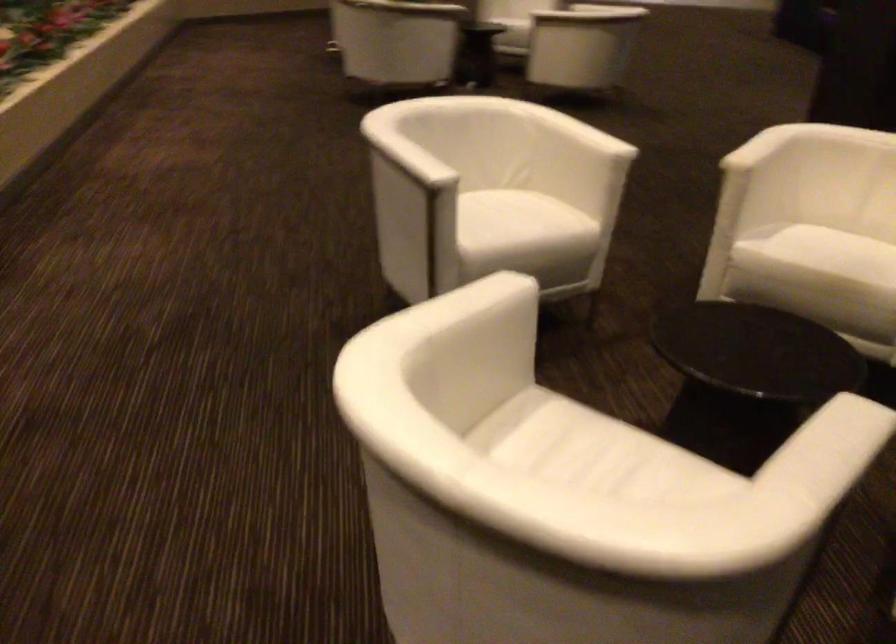
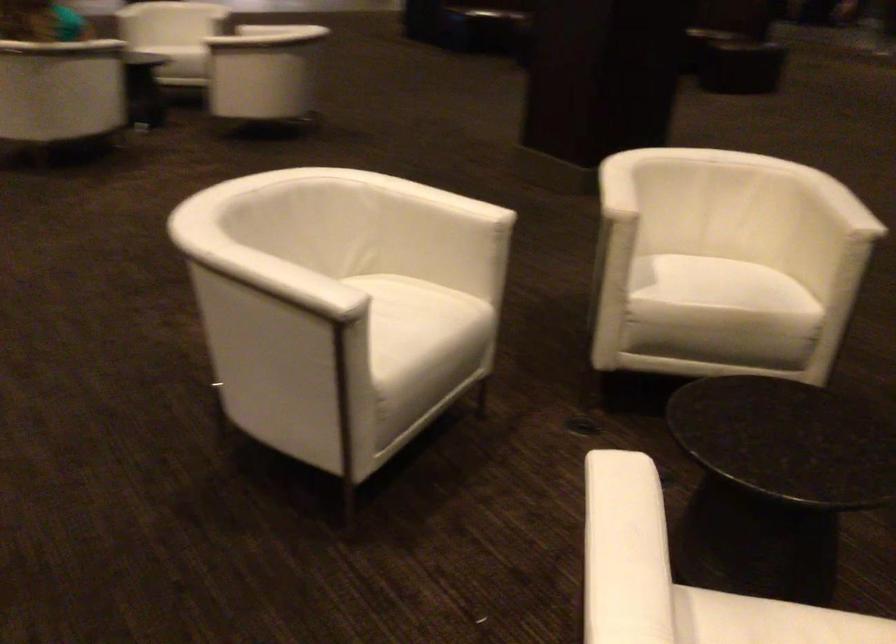
The images are taken continuously from a first-person perspective. In which direction are you moving?

The movement direction of the cameraman is left, forward.